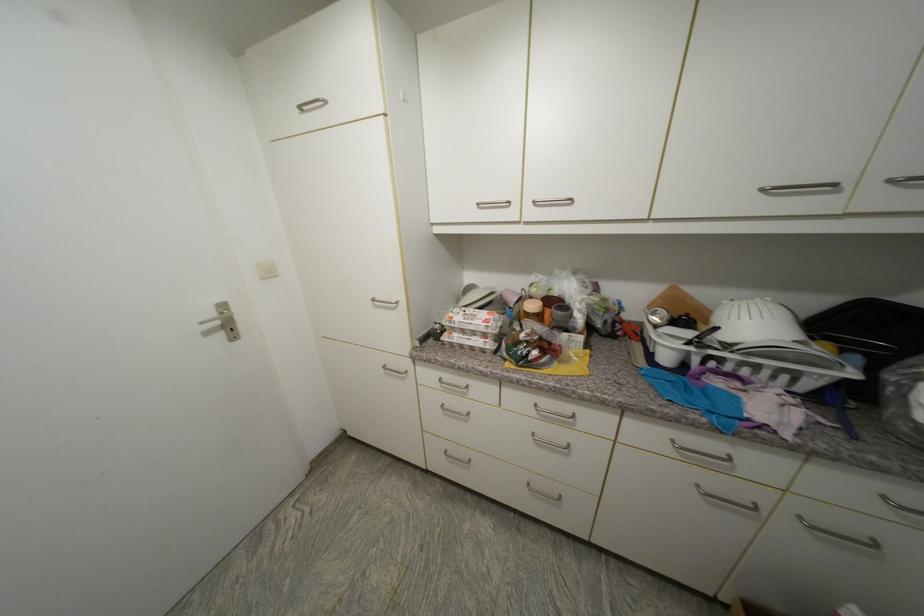
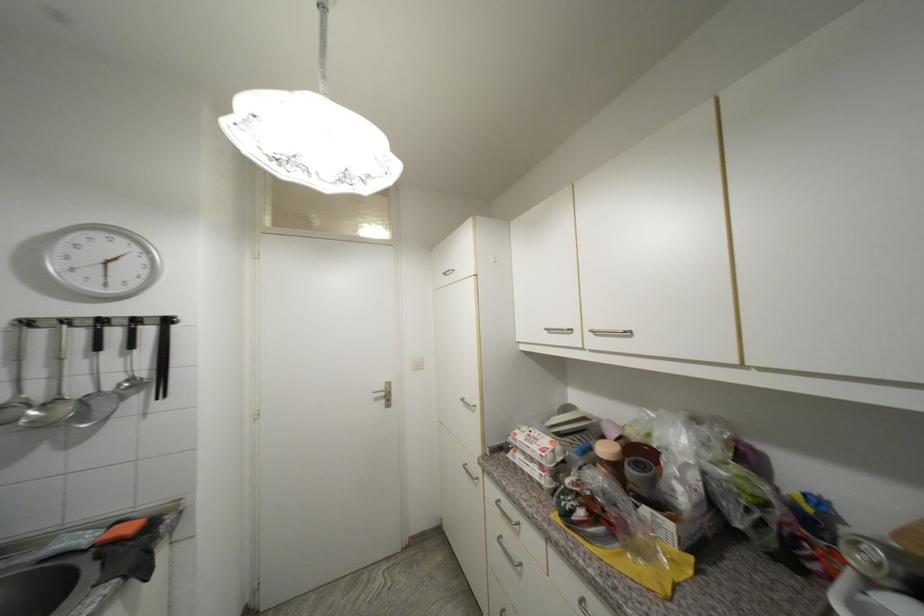
Question: I am providing you with two images of the same scene from different viewpoints. Please identify which objects are invisible in image2.

Choices:
 (A) metal cabinet handle
 (B) metal ladle
 (C) white egg carton
 (D) none of these

Answer: (D)